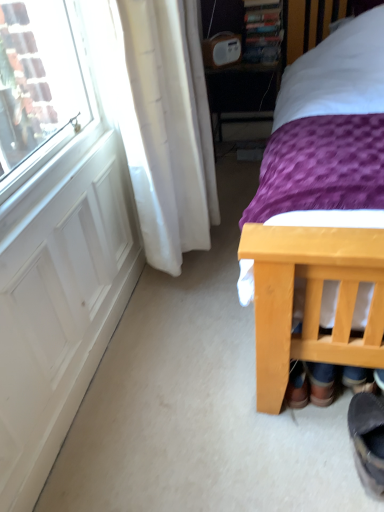
Describe the element at coordinates (368, 439) in the screenshot. The image size is (384, 512). I see `dark grey suede boot at lower right` at that location.

What do you see at coordinates (59, 300) in the screenshot?
I see `white matte screen door at left` at bounding box center [59, 300].

Where is `purple fabric bed at right`? purple fabric bed at right is located at coordinates (314, 293).

Is point (371, 404) closer or farther from the camera than point (354, 36)?

Point (371, 404) is positioned closer to the camera compared to point (354, 36).

Considering the sizes of objects dark grey suede boot at lower right and purple fabric bed at right in the image provided, who is wider, dark grey suede boot at lower right or purple fabric bed at right?

With larger width is purple fabric bed at right.

Choose the correct answer: Is dark grey suede boot at lower right inside purple fabric bed at right or outside it?

The correct answer is: inside.

Is dark grey suede boot at lower right oriented towards purple fabric bed at right?

Yes, dark grey suede boot at lower right is aimed at purple fabric bed at right.

From a real-world perspective, is white matte screen door at left beneath wooden table at center?

Yes.

Can you confirm if white matte screen door at left is smaller than wooden table at center?

Yes, white matte screen door at left is smaller than wooden table at center.

Is white matte screen door at left positioned with its back to wooden table at center?

No, white matte screen door at left's orientation is not away from wooden table at center.

Considering the relative positions of white matte screen door at left and wooden table at center in the image provided, is white matte screen door at left in front of wooden table at center?

Yes, white matte screen door at left is in front of wooden table at center.

Can you confirm if wooden table at center is positioned to the left of white matte screen door at left?

Incorrect, wooden table at center is not on the left side of white matte screen door at left.

Is wooden table at center far from white matte screen door at left?

Yes, wooden table at center is far from white matte screen door at left.

Does wooden table at center have a lesser height compared to white matte screen door at left?

In fact, wooden table at center may be taller than white matte screen door at left.

Measure the distance between wooden table at center and white matte screen door at left.

They are 5.50 feet apart.

From the image's perspective, is purple fabric bed at right over dark grey suede boot at lower right?

Yes, from the image's perspective, purple fabric bed at right is above dark grey suede boot at lower right.

Is purple fabric bed at right smaller than dark grey suede boot at lower right?

No.

Which of these two, purple fabric bed at right or dark grey suede boot at lower right, stands taller?

Standing taller between the two is purple fabric bed at right.

Is white matte screen door at left completely or partially outside of dark grey suede boot at lower right?

Indeed, white matte screen door at left is completely outside dark grey suede boot at lower right.

Where is `footwear on the right of white matte screen door at left`? The height and width of the screenshot is (512, 384). footwear on the right of white matte screen door at left is located at coordinates (368, 439).

How far apart are white matte screen door at left and dark grey suede boot at lower right?

The distance of white matte screen door at left from dark grey suede boot at lower right is 99.13 centimeters.

Which object is positioned more to the left, white matte screen door at left or dark grey suede boot at lower right?

From the viewer's perspective, white matte screen door at left appears more on the left side.

From a real-world perspective, who is located higher, wooden table at center or purple fabric bed at right?

From a 3D spatial view, purple fabric bed at right is above.

What's the angular difference between wooden table at center and purple fabric bed at right's facing directions?

The angular difference between wooden table at center and purple fabric bed at right is 0.354 degrees.

From the image's perspective, is wooden table at center above or below purple fabric bed at right?

Clearly, from the image's perspective, wooden table at center is above purple fabric bed at right.

Based on their positions, is wooden table at center located to the left or right of purple fabric bed at right?

wooden table at center is to the left of purple fabric bed at right.

Can we say wooden table at center lies outside dark grey suede boot at lower right?

wooden table at center lies outside dark grey suede boot at lower right's area.

In the scene shown: Is wooden table at center not near dark grey suede boot at lower right?

Indeed, wooden table at center is not near dark grey suede boot at lower right.

You are a GUI agent. You are given a task and a screenshot of the screen. Output one action in this format:
    pyautogui.click(x=<x>, y=<y>)
    Task: Click on the footwear located underneath the purple fabric bed at right (from a real-world perspective)
    
    Given the screenshot: What is the action you would take?
    pyautogui.click(x=368, y=439)

The image size is (384, 512). Find the location of `screen door on the left of wooden table at center`. screen door on the left of wooden table at center is located at coordinates (59, 300).

When comparing their distances from white matte screen door at left, does wooden table at center or dark grey suede boot at lower right seem further?

wooden table at center lies further to white matte screen door at left than the other object.

Looking at the image, which one is located further to dark grey suede boot at lower right, purple fabric bed at right or white matte screen door at left?

white matte screen door at left is further to dark grey suede boot at lower right.

From the image, which object appears to be farther from purple fabric bed at right, wooden table at center or dark grey suede boot at lower right?

Based on the image, wooden table at center appears to be further to purple fabric bed at right.

From the image, which object appears to be nearer to dark grey suede boot at lower right, wooden table at center or purple fabric bed at right?

Among the two, purple fabric bed at right is located nearer to dark grey suede boot at lower right.

Based on their spatial positions, is purple fabric bed at right or dark grey suede boot at lower right further from wooden table at center?

dark grey suede boot at lower right is positioned further to the anchor wooden table at center.

Based on their spatial positions, is purple fabric bed at right or dark grey suede boot at lower right closer to white matte screen door at left?

purple fabric bed at right is positioned closer to the anchor white matte screen door at left.

Based on their spatial positions, is dark grey suede boot at lower right or white matte screen door at left further from wooden table at center?

dark grey suede boot at lower right is further to wooden table at center.

Considering their positions, is white matte screen door at left positioned further to wooden table at center than dark grey suede boot at lower right?

dark grey suede boot at lower right.

Find the location of `screen door between wooden table at center and dark grey suede boot at lower right vertically`. screen door between wooden table at center and dark grey suede boot at lower right vertically is located at coordinates coord(59,300).

Locate an element on the screen. The image size is (384, 512). screen door between purple fabric bed at right and wooden table at center in the front-back direction is located at coordinates (59, 300).

Where is `footwear between purple fabric bed at right and wooden table at center in the front-back direction`? The width and height of the screenshot is (384, 512). footwear between purple fabric bed at right and wooden table at center in the front-back direction is located at coordinates (368, 439).

Locate an element on the screen. screen door between purple fabric bed at right and dark grey suede boot at lower right in the vertical direction is located at coordinates (59, 300).